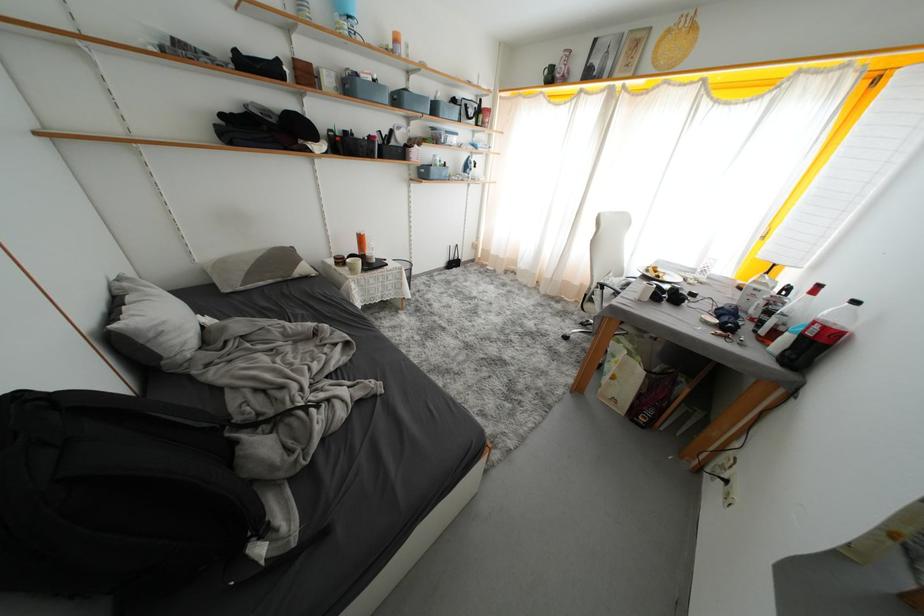
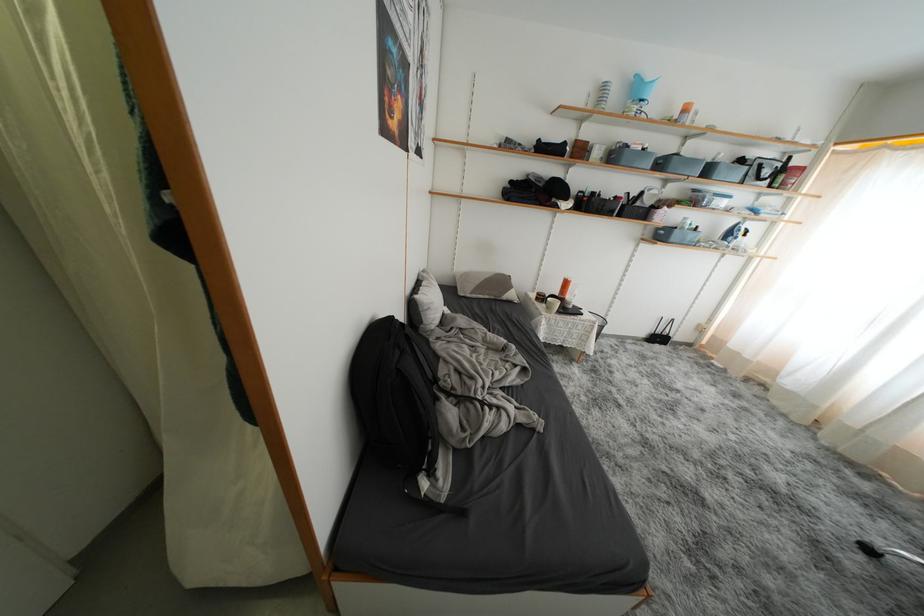
Where in the second image is the point corresponding to (368,243) from the first image?

(572, 286)